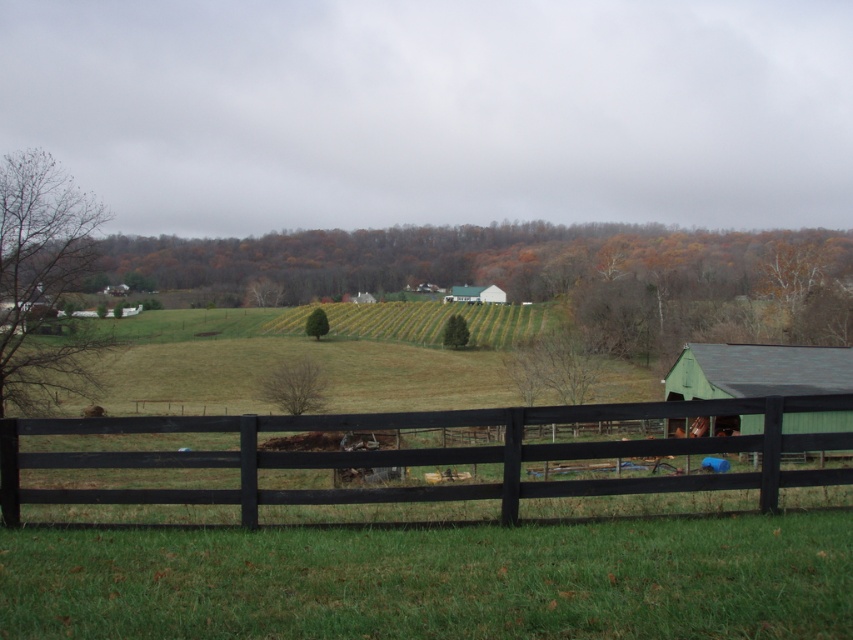
Does black wood fence at lower center appear over green matte barn at right?

Incorrect, black wood fence at lower center is not positioned above green matte barn at right.

Looking at this image, does black wood fence at lower center have a greater width compared to green matte barn at right?

No.

Consider the image. Who is more forward, (236, 493) or (672, 426)?

Point (236, 493) is in front.

I want to click on black wood fence at lower center, so click(422, 456).

Between black wood fence at lower center and white matte barn at center, which one appears on the right side from the viewer's perspective?

white matte barn at center

This screenshot has width=853, height=640. Find the location of `black wood fence at lower center`. black wood fence at lower center is located at coordinates (422, 456).

Identify the location of black wood fence at lower center. Image resolution: width=853 pixels, height=640 pixels. (422, 456).

Which of these two, green matte barn at right or white matte barn at center, stands shorter?

white matte barn at center

Looking at this image, between green matte barn at right and white matte barn at center, which one has more height?

With more height is green matte barn at right.

This screenshot has width=853, height=640. Find the location of `green matte barn at right`. green matte barn at right is located at coordinates (757, 371).